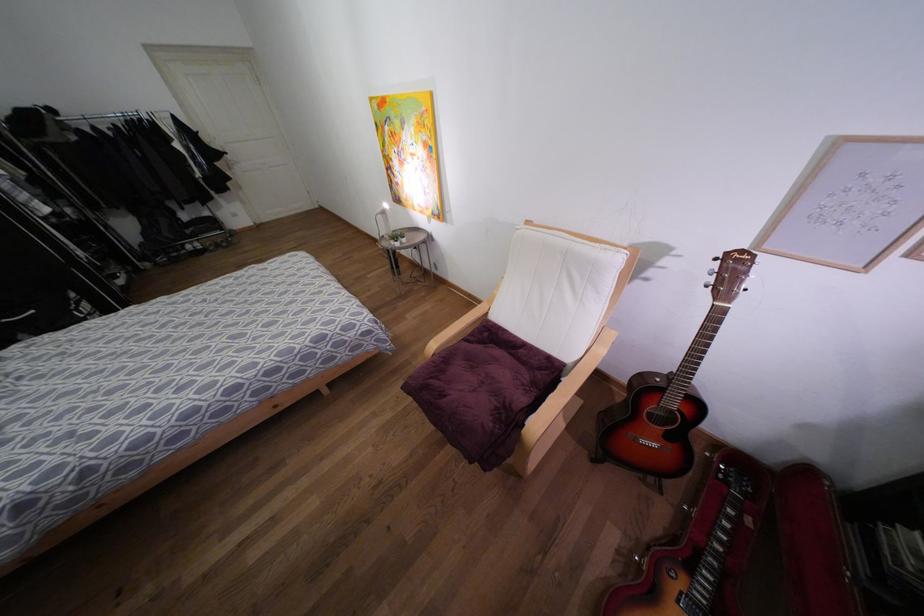
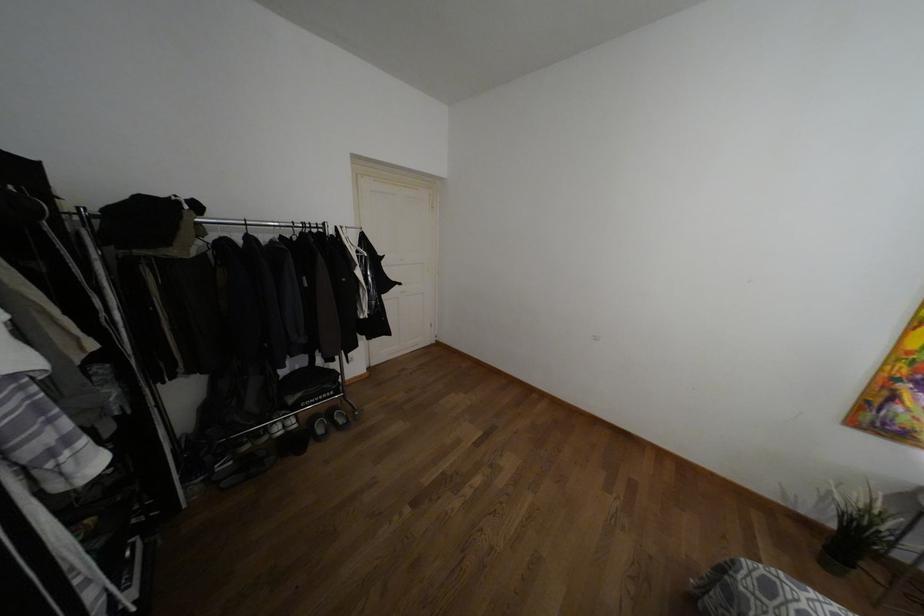
In the second image, find the point that corresponds to [188,232] in the first image.

(290, 399)